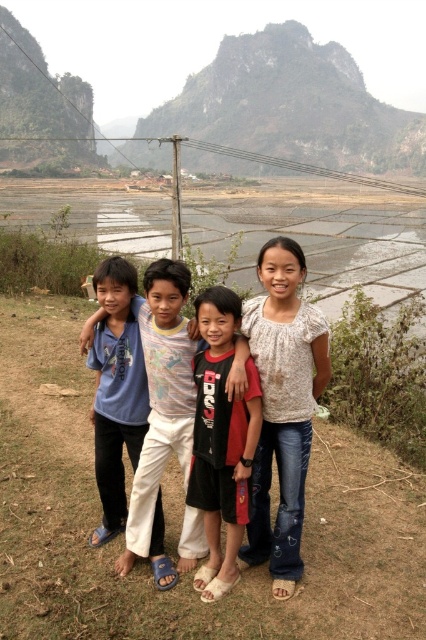
In the scene shown: You are a photographer trying to capture the rocky gray mountain at upper center in your shot. The camera is set at a focal length of 50mm. If you want to include all four children in the frame without moving the camera, should you zoom in or zoom out?

Since the rocky gray mountain at upper center is positioned at point coordinates, zooming out would allow capturing both the mountain and the children without moving the camera. Zooming in would narrow the field of view, potentially excluding the children.

Looking at the image, where is the rocky gray mountain at upper center located in terms of coordinates?

The rocky gray mountain at upper center is located at coordinates point (291, 106).